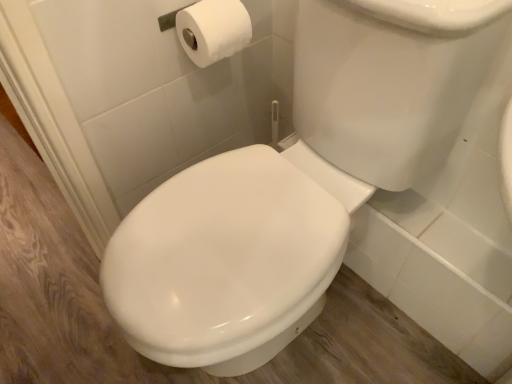
What do you see at coordinates (213, 30) in the screenshot?
I see `white paper at upper left` at bounding box center [213, 30].

The image size is (512, 384). What are the coordinates of `white paper at upper left` in the screenshot? It's located at (213, 30).

At what (x,y) coordinates should I click in order to perform the action: click on white paper at upper left. Please return your answer as a coordinate pair (x, y). Looking at the image, I should click on (213, 30).